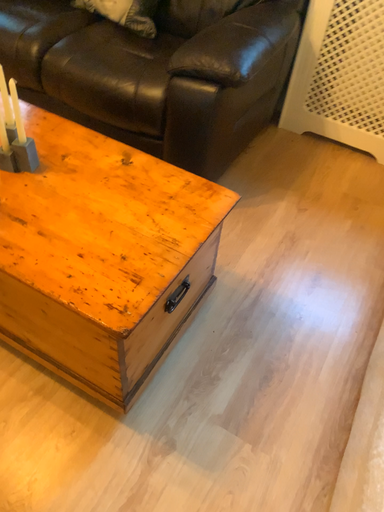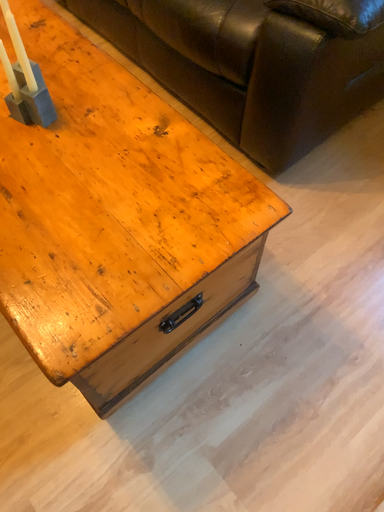
Question: Which way did the camera rotate in the video?

Choices:
 (A) rotated upward
 (B) rotated downward

Answer: (B)